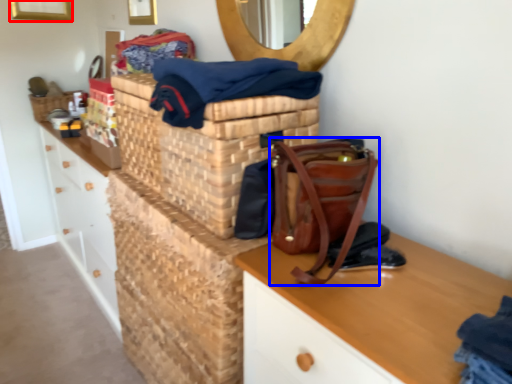
Question: Which point is closer to the camera, picture frame (highlighted by a red box) or handbag (highlighted by a blue box)?

Choices:
 (A) picture frame
 (B) handbag

Answer: (B)